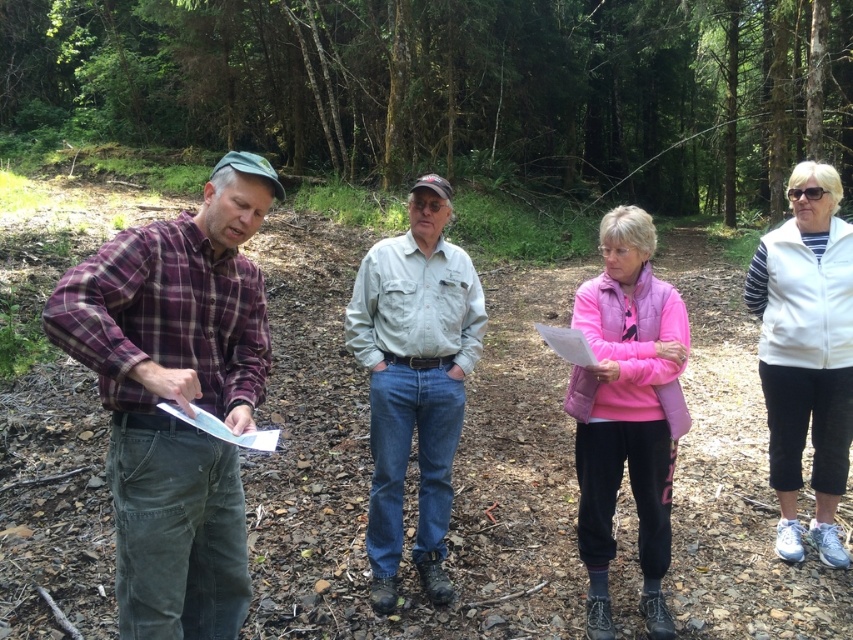
Who is positioned more to the left, pink fleece at center or pink matte clipboard at center?

Positioned to the left is pink matte clipboard at center.

The width and height of the screenshot is (853, 640). Describe the element at coordinates (627, 412) in the screenshot. I see `pink fleece at center` at that location.

You are a GUI agent. You are given a task and a screenshot of the screen. Output one action in this format:
    pyautogui.click(x=<x>, y=<y>)
    Task: Click on the pink fleece at center
    
    Given the screenshot: What is the action you would take?
    pyautogui.click(x=627, y=412)

Is point (166, 308) more distant than point (587, 365)?

No.

How much distance is there between plaid fabric shirt at left and pink matte clipboard at center?

plaid fabric shirt at left is 1.60 meters from pink matte clipboard at center.

Where is `plaid fabric shirt at left`? This screenshot has height=640, width=853. plaid fabric shirt at left is located at coordinates (177, 397).

This screenshot has height=640, width=853. I want to click on plaid fabric shirt at left, so click(177, 397).

Which of these two, light gray cotton shirt at center or pink fleece at center, stands taller?

With more height is light gray cotton shirt at center.

Is light gray cotton shirt at center thinner than pink fleece at center?

No.

Is point (428, 276) closer to viewer compared to point (659, 401)?

No, (428, 276) is further to viewer.

This screenshot has height=640, width=853. I want to click on light gray cotton shirt at center, so click(415, 381).